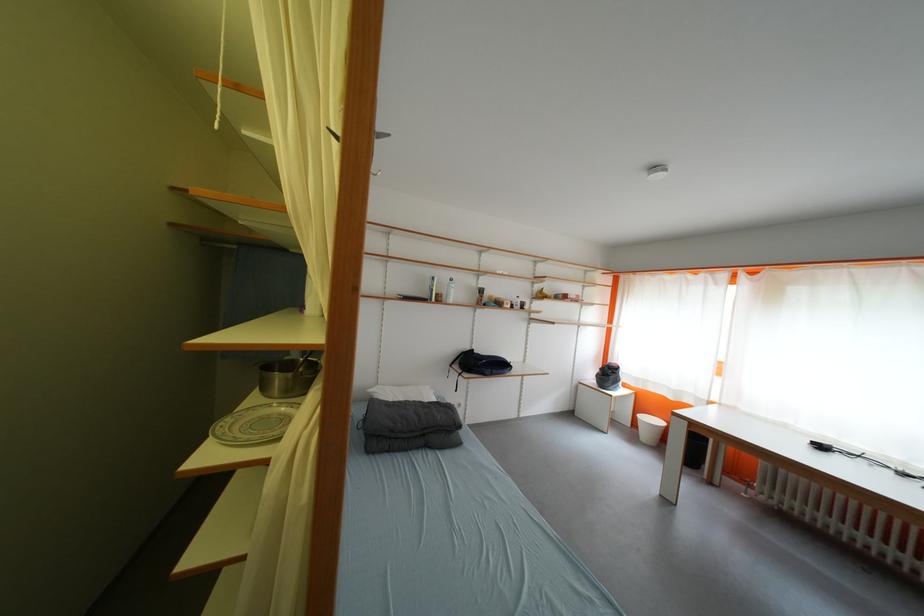
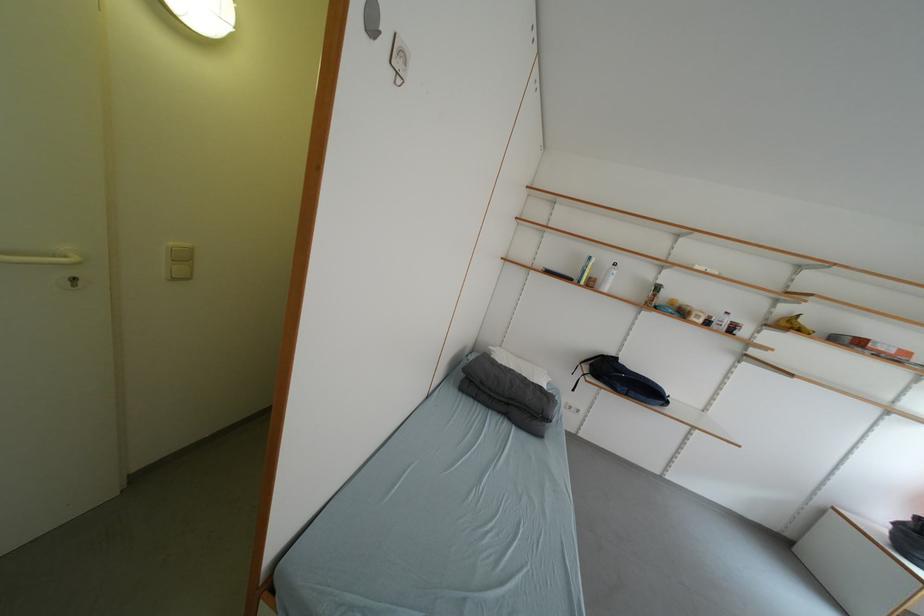
Find the pixel in the second image that matches point 447,302 in the first image.

(600, 286)